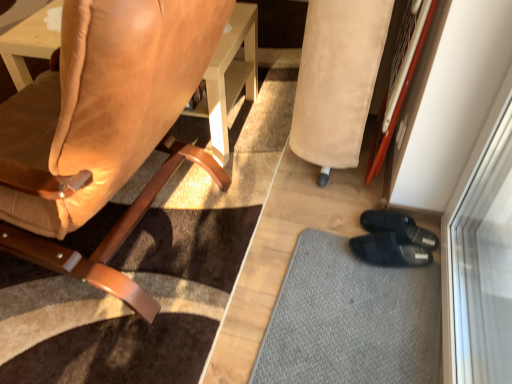
I want to click on blank area beneath gray textured mat at lower right (from a real-world perspective), so click(368, 297).